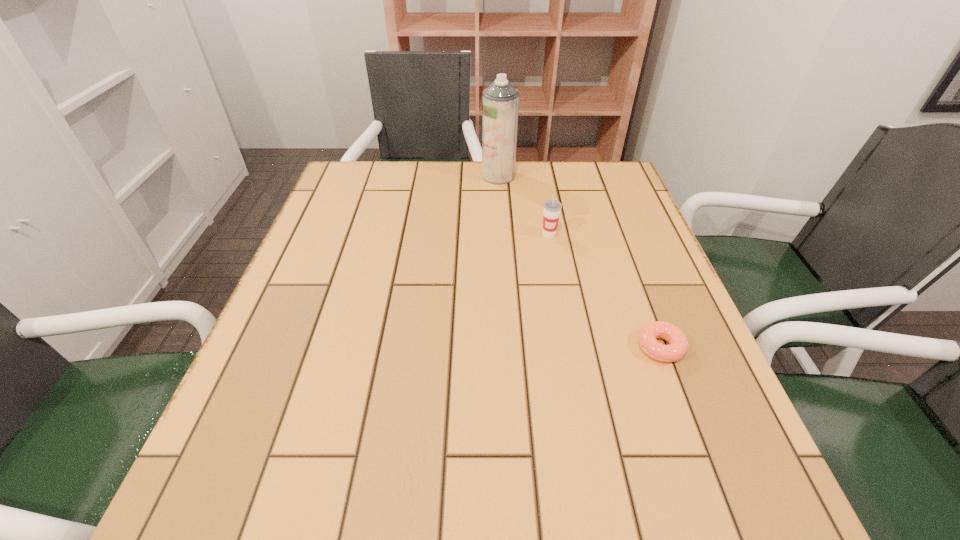
Locate an element on the screen. object that is at the right edge is located at coordinates (678, 344).

This screenshot has width=960, height=540. I want to click on free space at the far edge, so click(446, 171).

Where is `free region at the near edge of the desktop`? free region at the near edge of the desktop is located at coordinates (646, 510).

Where is `blank space at the left edge of the desktop`? The width and height of the screenshot is (960, 540). blank space at the left edge of the desktop is located at coordinates (305, 354).

This screenshot has width=960, height=540. Find the location of `blank space at the right edge`. blank space at the right edge is located at coordinates (689, 339).

You are a GUI agent. You are given a task and a screenshot of the screen. Output one action in this format:
    pyautogui.click(x=<x>, y=<y>)
    Task: Click on the vacant region at the near left corner
    The height and width of the screenshot is (540, 960).
    Given the screenshot: What is the action you would take?
    pyautogui.click(x=203, y=501)

The image size is (960, 540). Find the location of `vacant area that lies between the farthest object and the nearest object`. vacant area that lies between the farthest object and the nearest object is located at coordinates (580, 261).

Where is `vacant space in between the farthest object and the nearest object`? This screenshot has height=540, width=960. vacant space in between the farthest object and the nearest object is located at coordinates (580, 261).

You are a GUI agent. You are given a task and a screenshot of the screen. Output one action in this format:
    pyautogui.click(x=<x>, y=<y>)
    Task: Click on the free space between the doughnut and the second nearest object
    
    Given the screenshot: What is the action you would take?
    pyautogui.click(x=605, y=291)

Locate an element on the screen. This screenshot has height=540, width=960. empty space between the rightmost object and the second shortest object is located at coordinates (605, 291).